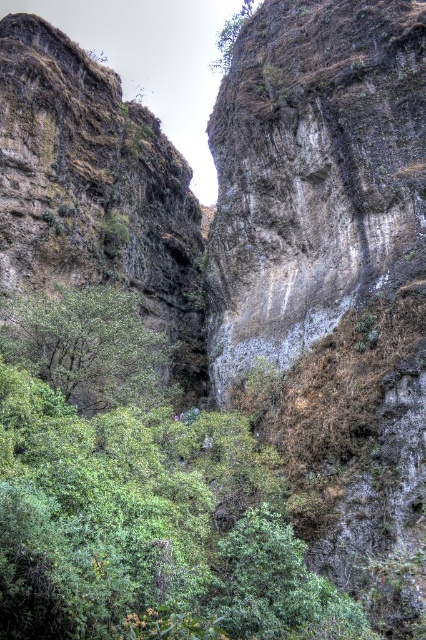
You are a hiker standing at the base of the cliffs and want to reach the highest point possible. Which point, point [409,116] or point [250,10], is closer to you?

Point [409,116] is closer to the camera than point [250,10], so it is closer to you as the hiker standing at the base.

You are standing at the base of the cliffs and looking towards the dense green foliage. There are two points marked on your map, point 1 at coordinates point (115, 260) and point 2 at coordinates point (218, 33). Which point is closer to you?

Point (115, 260) is in front of point (218, 33), so point (115, 260) is closer to you.